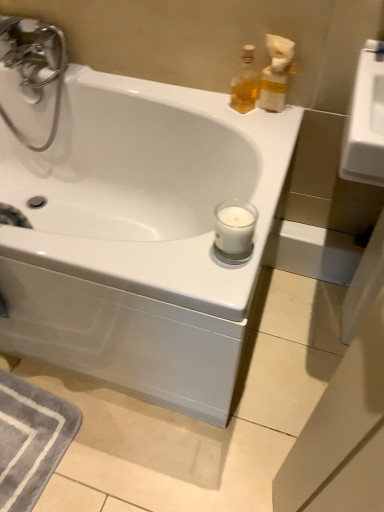
Where is `white glossy bathtub at center`? white glossy bathtub at center is located at coordinates [x=139, y=236].

You are a GUI agent. You are given a task and a screenshot of the screen. Output one action in this format:
    pyautogui.click(x=<x>, y=<y>)
    Task: Click on the translucent plastic soap dispenser at upper right, acting as the 2th soap dispenser starting from the left
    The width and height of the screenshot is (384, 512).
    Given the screenshot: What is the action you would take?
    pyautogui.click(x=276, y=73)

What do you see at coordinates (245, 83) in the screenshot?
I see `translucent glass bottle at upper right, the first soap dispenser in the left-to-right sequence` at bounding box center [245, 83].

At what (x,y) coordinates should I click in order to perform the action: click on white glossy bathtub at center. Please return your answer as a coordinate pair (x, y). The image size is (384, 512). Looking at the image, I should click on (139, 236).

From the image's perspective, is translucent plastic soap dispenser at upper right, acting as the 2th soap dispenser starting from the left, above or below white glossy bathtub at center?

translucent plastic soap dispenser at upper right, acting as the 2th soap dispenser starting from the left, is above white glossy bathtub at center.

Can you confirm if translucent plastic soap dispenser at upper right, the 1th soap dispenser when ordered from right to left, is wider than white glossy bathtub at center?

In fact, translucent plastic soap dispenser at upper right, the 1th soap dispenser when ordered from right to left, might be narrower than white glossy bathtub at center.

Who is taller, translucent plastic soap dispenser at upper right, the 1th soap dispenser when ordered from right to left, or white glossy bathtub at center?

white glossy bathtub at center.

Can you tell me how much translucent plastic soap dispenser at upper right, acting as the 2th soap dispenser starting from the left, and white glossy bathtub at center differ in facing direction?

They differ by 11.6 degrees in their facing directions.

From a real-world perspective, does translucent glass bottle at upper right, the first soap dispenser in the left-to-right sequence, sit lower than translucent plastic soap dispenser at upper right, acting as the 2th soap dispenser starting from the left?

Yes, from a real-world perspective, translucent glass bottle at upper right, the first soap dispenser in the left-to-right sequence, is below translucent plastic soap dispenser at upper right, acting as the 2th soap dispenser starting from the left.

From the picture: From the image's perspective, is translucent glass bottle at upper right, the first soap dispenser in the left-to-right sequence, positioned above or below translucent plastic soap dispenser at upper right, acting as the 2th soap dispenser starting from the left?

translucent glass bottle at upper right, the first soap dispenser in the left-to-right sequence, is above translucent plastic soap dispenser at upper right, acting as the 2th soap dispenser starting from the left.

How far apart are translucent glass bottle at upper right, placed as the 2th soap dispenser when sorted from right to left, and translucent plastic soap dispenser at upper right, the 1th soap dispenser when ordered from right to left?

They are 2.21 inches apart.

Would you say translucent glass bottle at upper right, placed as the 2th soap dispenser when sorted from right to left, is to the left or to the right of translucent plastic soap dispenser at upper right, the 1th soap dispenser when ordered from right to left, in the picture?

In the image, translucent glass bottle at upper right, placed as the 2th soap dispenser when sorted from right to left, appears on the left side of translucent plastic soap dispenser at upper right, the 1th soap dispenser when ordered from right to left.

Is point (239, 76) closer to viewer compared to point (210, 143)?

Yes.

Find the location of `the 2nd soap dispenser positioned above the white glossy bathtub at center (from the image's perspective)`. the 2nd soap dispenser positioned above the white glossy bathtub at center (from the image's perspective) is located at coordinates (245, 83).

Is translucent glass bottle at upper right, the first soap dispenser in the left-to-right sequence, turned away from white glossy bathtub at center?

No, translucent glass bottle at upper right, the first soap dispenser in the left-to-right sequence, is not facing the opposite direction of white glossy bathtub at center.

Is white glossy bathtub at center at the right side of translucent plastic soap dispenser at upper right, the 1th soap dispenser when ordered from right to left?

Incorrect, white glossy bathtub at center is not on the right side of translucent plastic soap dispenser at upper right, the 1th soap dispenser when ordered from right to left.

Looking at their sizes, would you say white glossy bathtub at center is wider or thinner than translucent plastic soap dispenser at upper right, the 1th soap dispenser when ordered from right to left?

Clearly, white glossy bathtub at center has more width compared to translucent plastic soap dispenser at upper right, the 1th soap dispenser when ordered from right to left.

Does white glossy bathtub at center have a smaller size compared to translucent plastic soap dispenser at upper right, acting as the 2th soap dispenser starting from the left?

Actually, white glossy bathtub at center might be larger than translucent plastic soap dispenser at upper right, acting as the 2th soap dispenser starting from the left.

Which of these two, white glossy bathtub at center or translucent glass bottle at upper right, placed as the 2th soap dispenser when sorted from right to left, is thinner?

With smaller width is translucent glass bottle at upper right, placed as the 2th soap dispenser when sorted from right to left.

The width and height of the screenshot is (384, 512). I want to click on bathtub below the translucent glass bottle at upper right, the first soap dispenser in the left-to-right sequence (from the image's perspective), so click(139, 236).

Are white glossy bathtub at center and translucent glass bottle at upper right, placed as the 2th soap dispenser when sorted from right to left, beside each other?

There is a gap between white glossy bathtub at center and translucent glass bottle at upper right, placed as the 2th soap dispenser when sorted from right to left.

From a real-world perspective, between translucent plastic soap dispenser at upper right, the 1th soap dispenser when ordered from right to left, and translucent glass bottle at upper right, the first soap dispenser in the left-to-right sequence, who is vertically lower?

In real-world perspective, translucent glass bottle at upper right, the first soap dispenser in the left-to-right sequence, is lower.

Can you confirm if translucent plastic soap dispenser at upper right, acting as the 2th soap dispenser starting from the left, is wider than translucent glass bottle at upper right, the first soap dispenser in the left-to-right sequence?

Yes, translucent plastic soap dispenser at upper right, acting as the 2th soap dispenser starting from the left, is wider than translucent glass bottle at upper right, the first soap dispenser in the left-to-right sequence.

Is translucent plastic soap dispenser at upper right, acting as the 2th soap dispenser starting from the left, shorter than translucent glass bottle at upper right, the first soap dispenser in the left-to-right sequence?

Incorrect, the height of translucent plastic soap dispenser at upper right, acting as the 2th soap dispenser starting from the left, does not fall short of that of translucent glass bottle at upper right, the first soap dispenser in the left-to-right sequence.

In the scene shown: Is translucent plastic soap dispenser at upper right, the 1th soap dispenser when ordered from right to left, not inside translucent glass bottle at upper right, the first soap dispenser in the left-to-right sequence?

That's correct, translucent plastic soap dispenser at upper right, the 1th soap dispenser when ordered from right to left, is outside of translucent glass bottle at upper right, the first soap dispenser in the left-to-right sequence.

From a real-world perspective, which soap dispenser is the 2nd one above the white glossy bathtub at center? Please provide its 2D coordinates.

[(276, 73)]

At what (x,y) coordinates should I click in order to perform the action: click on soap dispenser that appears in front of the translucent glass bottle at upper right, the first soap dispenser in the left-to-right sequence. Please return your answer as a coordinate pair (x, y). This screenshot has height=512, width=384. Looking at the image, I should click on (276, 73).

Looking at the image, which one is located closer to white glossy bathtub at center, translucent plastic soap dispenser at upper right, the 1th soap dispenser when ordered from right to left, or translucent glass bottle at upper right, the first soap dispenser in the left-to-right sequence?

translucent glass bottle at upper right, the first soap dispenser in the left-to-right sequence, lies closer to white glossy bathtub at center than the other object.

When comparing their distances from translucent plastic soap dispenser at upper right, the 1th soap dispenser when ordered from right to left, does white glossy bathtub at center or translucent glass bottle at upper right, placed as the 2th soap dispenser when sorted from right to left, seem further?

white glossy bathtub at center is positioned further to the anchor translucent plastic soap dispenser at upper right, the 1th soap dispenser when ordered from right to left.

Based on their spatial positions, is translucent glass bottle at upper right, placed as the 2th soap dispenser when sorted from right to left, or translucent plastic soap dispenser at upper right, acting as the 2th soap dispenser starting from the left, closer to white glossy bathtub at center?

translucent glass bottle at upper right, placed as the 2th soap dispenser when sorted from right to left, lies closer to white glossy bathtub at center than the other object.

When comparing their distances from translucent glass bottle at upper right, placed as the 2th soap dispenser when sorted from right to left, does white glossy bathtub at center or translucent plastic soap dispenser at upper right, acting as the 2th soap dispenser starting from the left, seem closer?

translucent plastic soap dispenser at upper right, acting as the 2th soap dispenser starting from the left, is positioned closer to the anchor translucent glass bottle at upper right, placed as the 2th soap dispenser when sorted from right to left.

From the image, which object appears to be farther from translucent plastic soap dispenser at upper right, the 1th soap dispenser when ordered from right to left, translucent glass bottle at upper right, placed as the 2th soap dispenser when sorted from right to left, or white glossy bathtub at center?

Based on the image, white glossy bathtub at center appears to be further to translucent plastic soap dispenser at upper right, the 1th soap dispenser when ordered from right to left.

Estimate the real-world distances between objects in this image. Which object is further from translucent glass bottle at upper right, placed as the 2th soap dispenser when sorted from right to left, translucent plastic soap dispenser at upper right, acting as the 2th soap dispenser starting from the left, or white glossy bathtub at center?

Among the two, white glossy bathtub at center is located further to translucent glass bottle at upper right, placed as the 2th soap dispenser when sorted from right to left.

Identify the location of soap dispenser between white glossy bathtub at center and translucent plastic soap dispenser at upper right, acting as the 2th soap dispenser starting from the left, from left to right. The height and width of the screenshot is (512, 384). (245, 83).